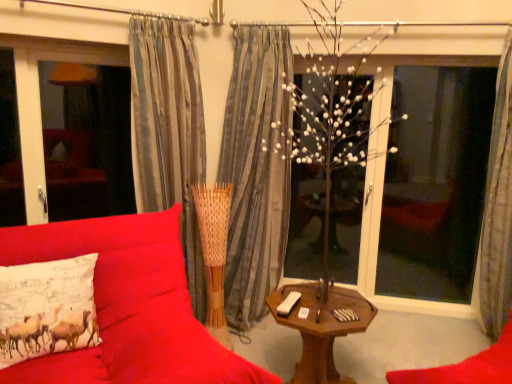
Question: Is striped fabric curtain at center, the 2th curtain positioned from the right, taller than gray striped curtain at right, arranged as the first curtain when viewed from the right?

Choices:
 (A) no
 (B) yes

Answer: (B)

Question: Is striped fabric curtain at center, the 2th curtain positioned from the right, to the right of gray striped curtain at right, arranged as the first curtain when viewed from the right, from the viewer's perspective?

Choices:
 (A) no
 (B) yes

Answer: (A)

Question: Is gray striped curtain at right, arranged as the first curtain when viewed from the right, surrounded by striped fabric curtain at center, the 2th curtain positioned from the left?

Choices:
 (A) yes
 (B) no

Answer: (B)

Question: Can you confirm if striped fabric curtain at center, the 2th curtain positioned from the right, is positioned to the left of gray striped curtain at right, positioned as the third curtain in left-to-right order?

Choices:
 (A) yes
 (B) no

Answer: (A)

Question: Is striped fabric curtain at center, the 2th curtain positioned from the left, further to camera compared to gray striped curtain at right, arranged as the first curtain when viewed from the right?

Choices:
 (A) yes
 (B) no

Answer: (A)

Question: Can you confirm if striped fabric curtain at center, the 2th curtain positioned from the left, is wider than gray striped curtain at right, positioned as the third curtain in left-to-right order?

Choices:
 (A) no
 (B) yes

Answer: (A)

Question: From a real-world perspective, is white matte tree at center beneath wooden table at center?

Choices:
 (A) no
 (B) yes

Answer: (A)

Question: Does white matte tree at center turn towards wooden table at center?

Choices:
 (A) yes
 (B) no

Answer: (A)

Question: Is white matte tree at center taller than wooden table at center?

Choices:
 (A) yes
 (B) no

Answer: (A)

Question: Is white matte tree at center looking in the opposite direction of wooden table at center?

Choices:
 (A) no
 (B) yes

Answer: (A)

Question: Can you confirm if white matte tree at center is bigger than wooden table at center?

Choices:
 (A) no
 (B) yes

Answer: (B)

Question: Is white matte tree at center to the left of wooden table at center from the viewer's perspective?

Choices:
 (A) no
 (B) yes

Answer: (A)

Question: From the image's perspective, is matte glass window screen at left, placed as the 2th window screen when sorted from right to left, under gray striped curtain at right, arranged as the first curtain when viewed from the right?

Choices:
 (A) no
 (B) yes

Answer: (A)